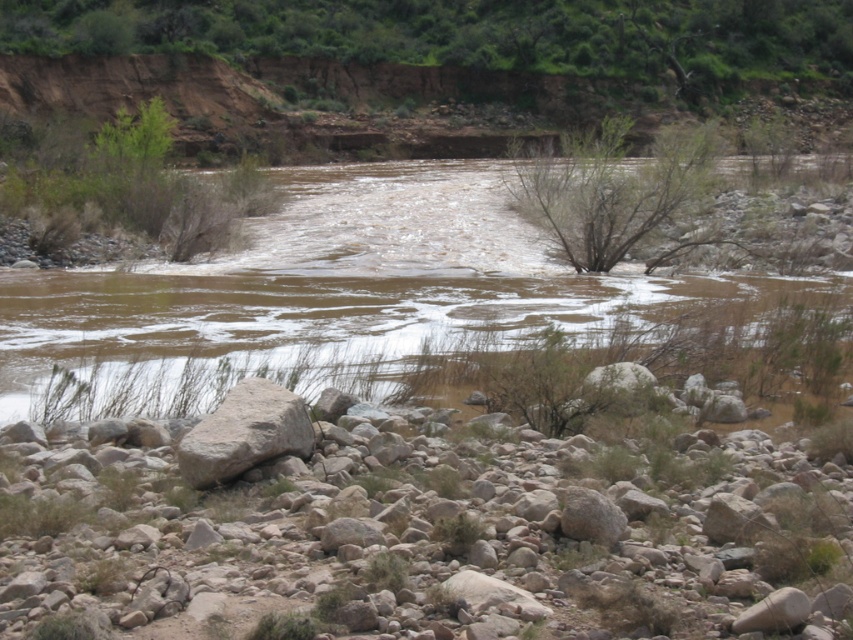
Can you confirm if brown muddy stream at center is wider than gray rough rock at lower left?

Indeed, brown muddy stream at center has a greater width compared to gray rough rock at lower left.

Between point (236, 339) and point (213, 416), which one is positioned behind?

Point (236, 339)

Who is more forward, (370, 314) or (267, 422)?

Point (267, 422)

Image resolution: width=853 pixels, height=640 pixels. Find the location of `brown muddy stream at center`. brown muddy stream at center is located at coordinates (334, 296).

Does gray rock at lower center come behind brown muddy stream at center?

No.

Is gray rock at lower center taller than brown muddy stream at center?

In fact, gray rock at lower center may be shorter than brown muddy stream at center.

Which is in front, point (241, 417) or point (271, 348)?

Point (241, 417) is in front.

Locate an element on the screen. This screenshot has width=853, height=640. gray rock at lower center is located at coordinates (421, 536).

Is gray rock at lower center shorter than gray rough rock at lower left?

Yes, gray rock at lower center is shorter than gray rough rock at lower left.

Locate an element on the screen. The image size is (853, 640). gray rock at lower center is located at coordinates (421, 536).

At what (x,y) coordinates should I click in order to perform the action: click on gray rock at lower center. Please return your answer as a coordinate pair (x, y). This screenshot has width=853, height=640. Looking at the image, I should click on (421, 536).